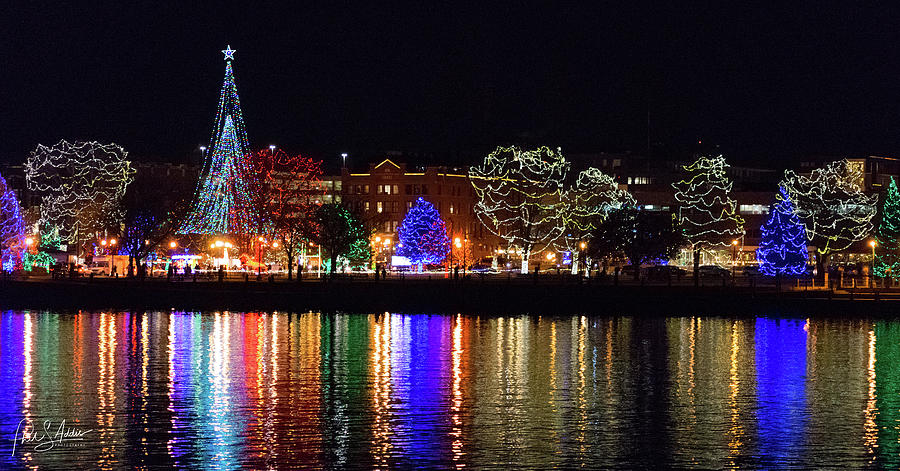
This screenshot has width=900, height=471. In order to click on windows in this screenshot , I will do coord(381,204), coord(384,189), coord(362,190), coord(364,209), coord(448,210).